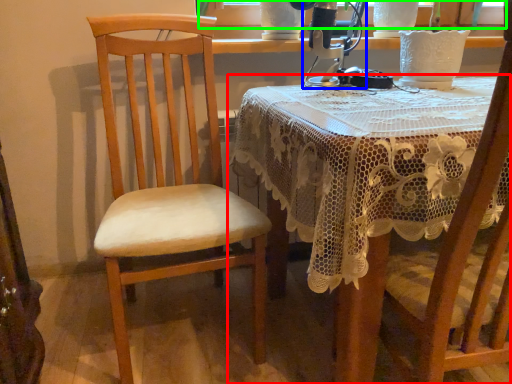
Question: Estimate the real-world distances between objects in this image. Which object is farther from table (highlighted by a red box), sewing machine (highlighted by a blue box) or window screen (highlighted by a green box)?

Choices:
 (A) sewing machine
 (B) window screen

Answer: (B)